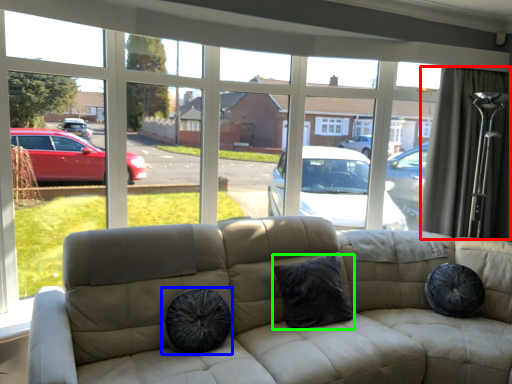
Question: Which object is the closest to the curtain (highlighted by a red box)? Choose among these: dog bed (highlighted by a blue box) or pillow (highlighted by a green box).

Choices:
 (A) dog bed
 (B) pillow

Answer: (B)